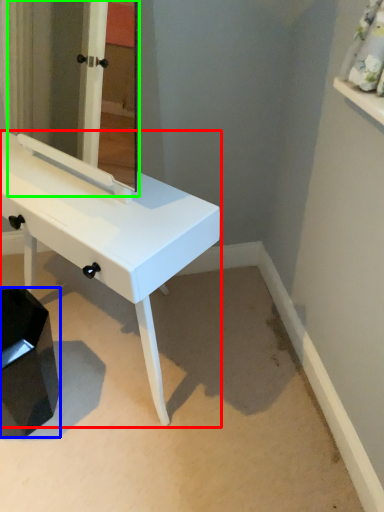
Question: Estimate the real-world distances between objects in this image. Which object is closer to table (highlighted by a red box), step stool (highlighted by a blue box) or mirror (highlighted by a green box)?

Choices:
 (A) step stool
 (B) mirror

Answer: (A)